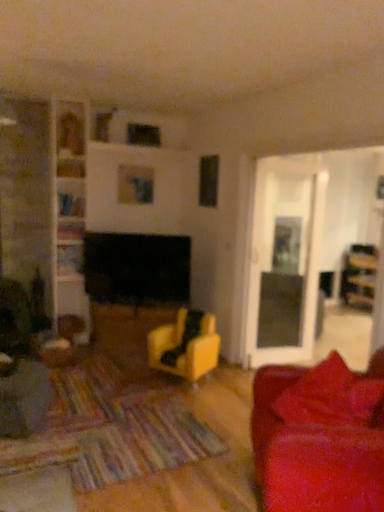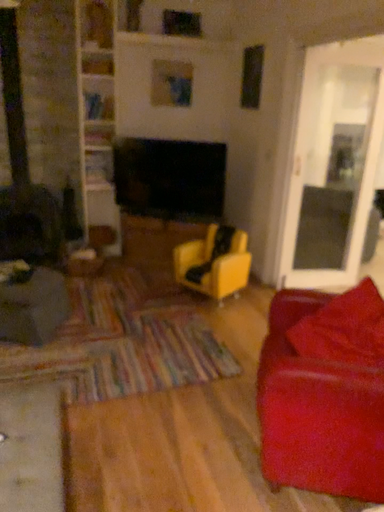
Question: Which way did the camera rotate in the video?

Choices:
 (A) rotated left
 (B) rotated right

Answer: (A)